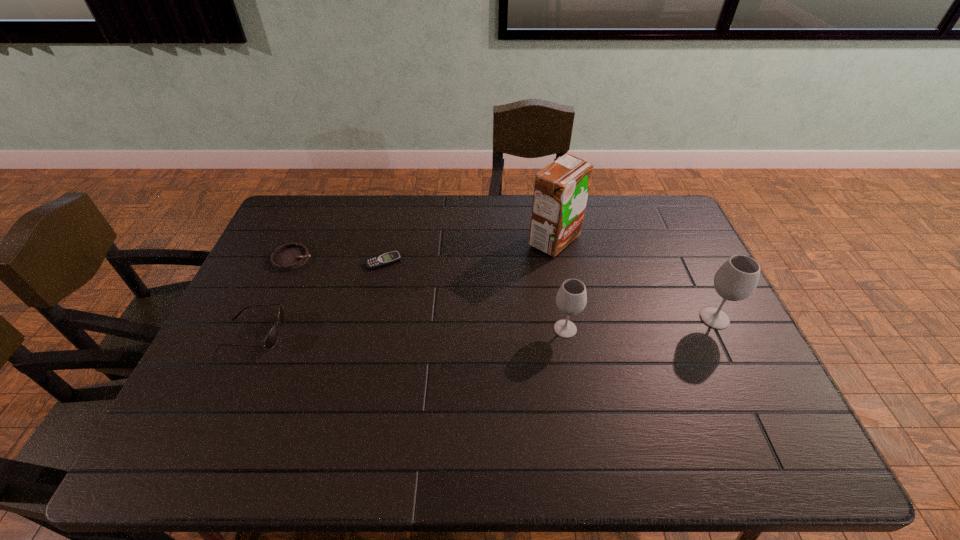
Identify the location of free space located 0.320m on the left of the right wineglass. Image resolution: width=960 pixels, height=540 pixels. (585, 319).

The width and height of the screenshot is (960, 540). Find the location of `vacant space located 0.330m on the straw side of the carton`. vacant space located 0.330m on the straw side of the carton is located at coordinates (430, 240).

Find the location of a particular element. vacant space located on the straw side of the carton is located at coordinates (480, 240).

Where is `blank space located on the straw side of the carton`? blank space located on the straw side of the carton is located at coordinates (447, 240).

You are a GUI agent. You are given a task and a screenshot of the screen. Output one action in this format:
    pyautogui.click(x=<x>, y=<y>)
    Task: Click on the vacant space situated on the front-facing side of the sunglasses
    
    Given the screenshot: What is the action you would take?
    pyautogui.click(x=389, y=333)

Locate an element on the screen. The image size is (960, 540). free point located 0.180m on the left of the shortest object is located at coordinates (310, 262).

This screenshot has height=540, width=960. Identify the location of free spot located on the right of the fifth tallest object. (363, 259).

Locate an element on the screen. object located in the far edge section of the desktop is located at coordinates (561, 189).

Image resolution: width=960 pixels, height=540 pixels. I want to click on sunglasses that is positioned at the left edge, so click(270, 341).

The height and width of the screenshot is (540, 960). Identify the location of ashtray that is at the left edge. (291, 256).